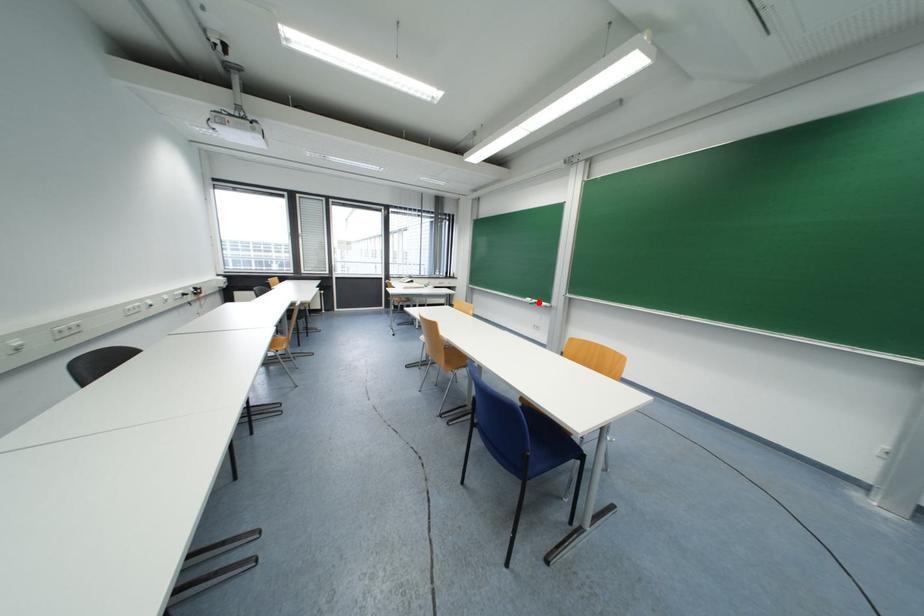
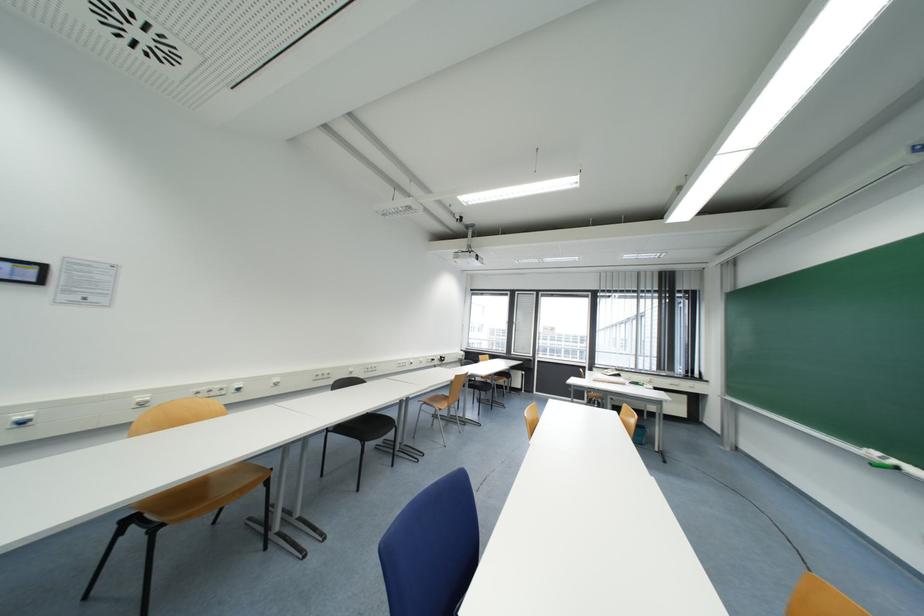
Question: I am providing you with two images of the same scene from different viewpoints. A red point is shown in image1. For the corresponding object point in image2, is it positioned nearer or farther from the camera?

Choices:
 (A) Nearer
 (B) Farther

Answer: (A)